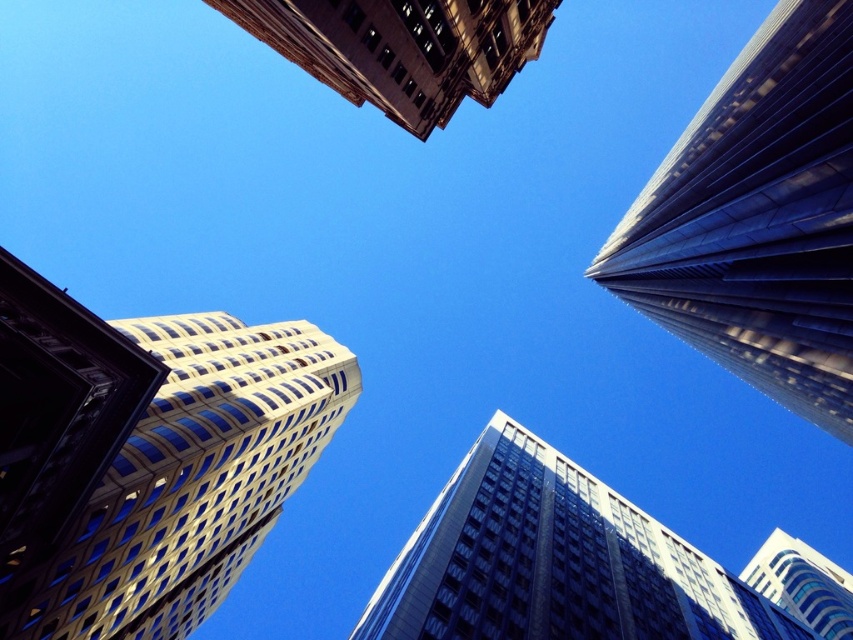
Consider the image. Can you confirm if matte glass skyscraper at center is thinner than brown stone building at upper center?

Correct, matte glass skyscraper at center's width is less than brown stone building at upper center's.

Which is in front, point (0, 372) or point (347, 44)?

Point (0, 372) is in front.

Between point (51, 524) and point (560, 1), which one is positioned behind?

The point (560, 1) is more distant.

Locate an element on the screen. The width and height of the screenshot is (853, 640). matte glass skyscraper at center is located at coordinates (55, 417).

Can you confirm if glassy reflective skyscraper at center is positioned to the right of matte glass skyscraper at center?

Correct, you'll find glassy reflective skyscraper at center to the right of matte glass skyscraper at center.

Between point (480, 486) and point (76, 406), which one is positioned in front?

Point (76, 406)

Find the location of a particular element. This screenshot has height=640, width=853. glassy reflective skyscraper at center is located at coordinates (x=554, y=561).

The width and height of the screenshot is (853, 640). I want to click on glassy reflective skyscraper at center, so click(554, 561).

Between glassy reflective skyscraper at center and white glass building at upper right, which one is positioned lower?

white glass building at upper right is lower down.

Is point (653, 604) closer to camera compared to point (822, 592)?

Yes, it is in front of point (822, 592).

Is point (711, 580) behind point (784, 540)?

No, (711, 580) is closer to viewer.

You are a GUI agent. You are given a task and a screenshot of the screen. Output one action in this format:
    pyautogui.click(x=<x>, y=<y>)
    Task: Click on the glassy reflective skyscraper at center
    The width and height of the screenshot is (853, 640).
    Given the screenshot: What is the action you would take?
    pyautogui.click(x=554, y=561)